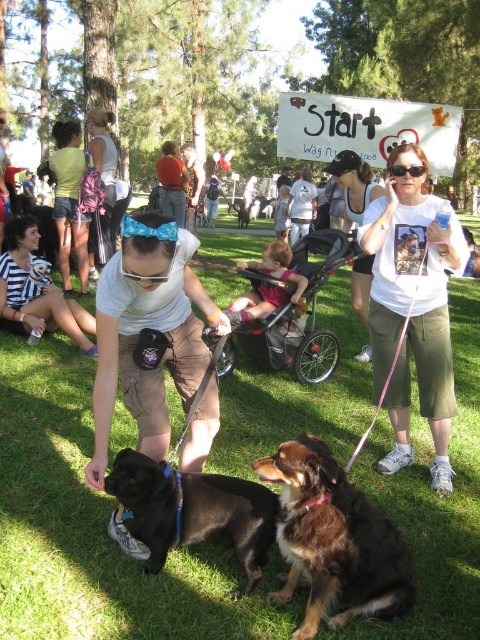
You are a photographer setting up a tripod in the park. You need to position it so that it doesn not block the striped fabric shirt at lower left or the brown furry dog at center. Given that the tripod requires 1 meter of space around it, can you place it between these two objects?

The striped fabric shirt at lower left is wider than the brown furry dog at center. Since the tripod needs 1 meter of space around it, you should place it at a distance where it doesn not interfere with either object, ensuring there is enough space between them. However, without knowing the exact distance between the two objects, it is impossible to confirm if the required space is available.